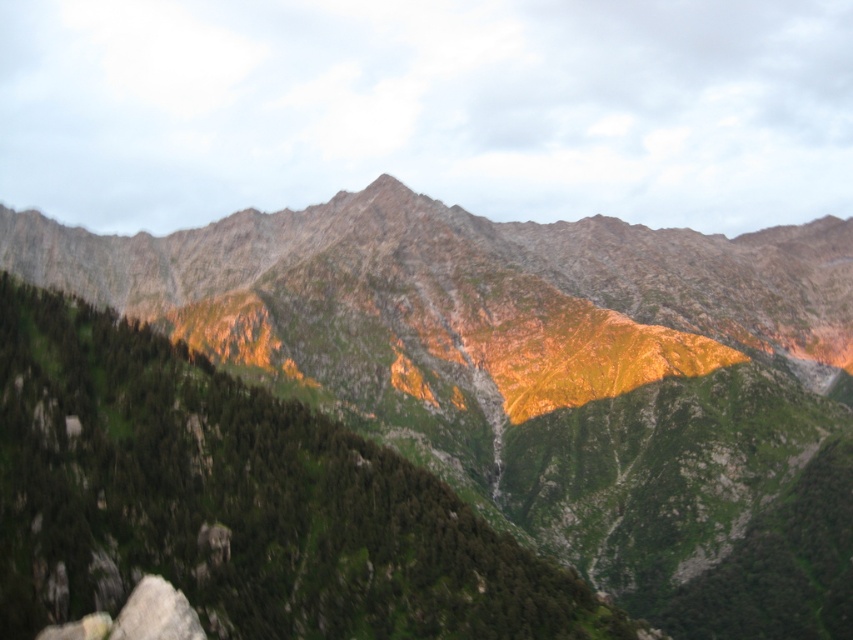
I want to click on green rocky mountain range at center, so click(x=544, y=378).

Who is lower down, green rocky mountain range at center or smooth gray rock at lower left?

smooth gray rock at lower left is below.

Is point (740, 371) farther from viewer compared to point (151, 620)?

Yes, point (740, 371) is farther from viewer.

In order to click on green rocky mountain range at center in this screenshot , I will do `click(544, 378)`.